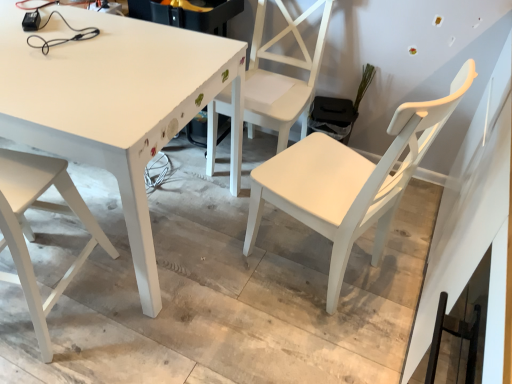
I want to click on vacant space in front of white matte chair at center, which is the 3th chair from left to right, so click(x=305, y=339).